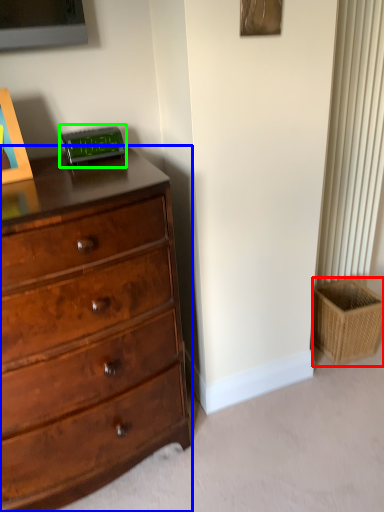
Question: Which is nearer to the basket (highlighted by a red box)? chest of drawers (highlighted by a blue box) or alarm clock (highlighted by a green box).

Choices:
 (A) chest of drawers
 (B) alarm clock

Answer: (A)